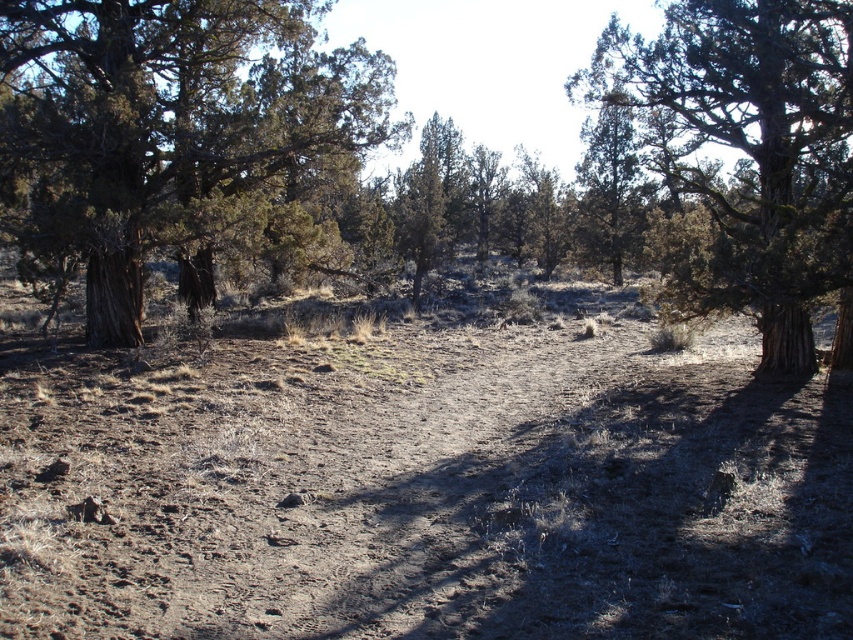
Which is below, brown textured trees at center or dark brown bark tree at upper left?

dark brown bark tree at upper left is lower down.

Does brown textured trees at center appear on the left side of dark brown bark tree at upper left?

Incorrect, brown textured trees at center is not on the left side of dark brown bark tree at upper left.

Which is behind, point (144, 218) or point (126, 150)?

Point (126, 150)

The width and height of the screenshot is (853, 640). Identify the location of brown textured trees at center. (172, 129).

Measure the distance between brown textured trees at center and camera.

They are 8.46 meters apart.

Is brown textured trees at center thinner than green textured tree at center?

No.

Is point (782, 337) behind point (828, 6)?

Yes, point (782, 337) is farther from viewer.

Where is `brown textured trees at center`? brown textured trees at center is located at coordinates (172, 129).

Does dark brown bark tree at upper left have a larger size compared to green textured tree at center?

No.

Consider the image. Does dark brown bark tree at upper left have a smaller size compared to green textured tree at center?

Indeed, dark brown bark tree at upper left has a smaller size compared to green textured tree at center.

Locate an element on the screen. The width and height of the screenshot is (853, 640). dark brown bark tree at upper left is located at coordinates (180, 134).

Identify the location of dark brown bark tree at upper left. The height and width of the screenshot is (640, 853). (180, 134).